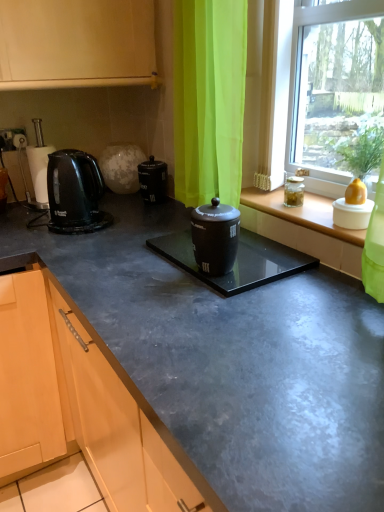
Identify the location of free space to the left of black plastic kettle at left. The width and height of the screenshot is (384, 512). (20, 203).